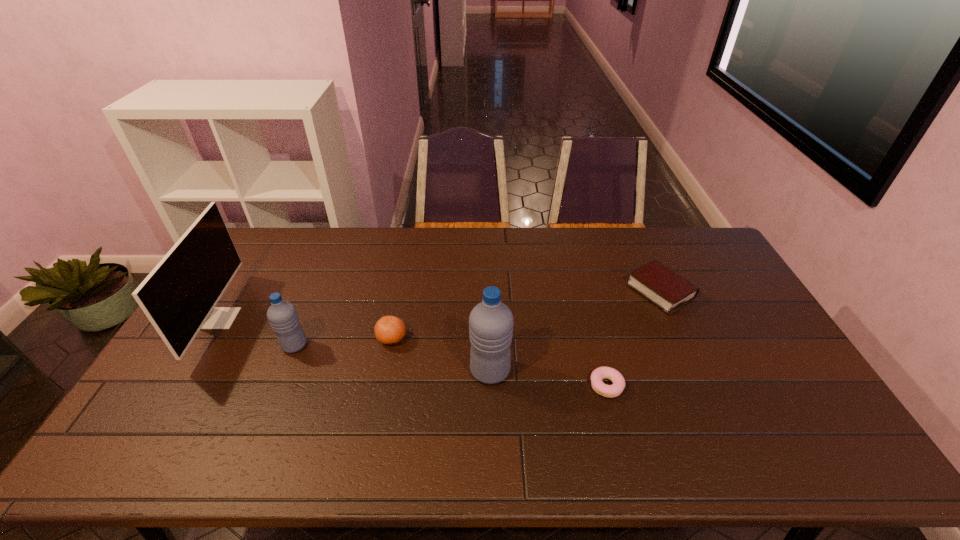
Where is `monitor`? monitor is located at coordinates (179, 295).

Locate an element on the screen. The height and width of the screenshot is (540, 960). vacant space located 0.100m on the front of the left water bottle is located at coordinates (278, 384).

Locate an element on the screen. free space located on the left of the fourth object from left to right is located at coordinates (405, 371).

I want to click on vacant region located on the left of the clementine, so click(249, 339).

Locate an element on the screen. free space located 0.290m on the left of the rightmost object is located at coordinates (541, 291).

Locate an element on the screen. This screenshot has height=540, width=960. vacant space situated 0.390m on the back of the shortest object is located at coordinates (579, 280).

Where is `vacant region located 0.390m on the front-facing side of the monitor`? The height and width of the screenshot is (540, 960). vacant region located 0.390m on the front-facing side of the monitor is located at coordinates (360, 318).

Identify the location of object that is at the near edge. (610, 391).

Identify the location of object at the left edge. (179, 295).

This screenshot has height=540, width=960. I want to click on vacant space at the far edge of the desktop, so click(x=599, y=251).